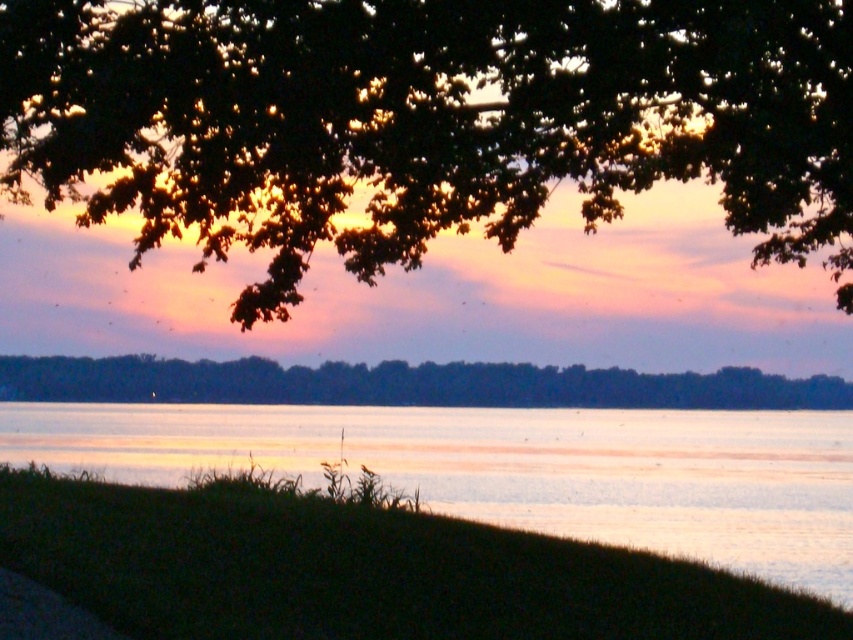
Is point (415, 483) closer to viewer compared to point (770, 396)?

Yes, it is.

Is silvery reflective water at lower center smaller than dark green leafy trees at center?

No.

What do you see at coordinates (515, 468) in the screenshot? I see `silvery reflective water at lower center` at bounding box center [515, 468].

You are a GUI agent. You are given a task and a screenshot of the screen. Output one action in this format:
    pyautogui.click(x=<x>, y=<y>)
    Task: Click on the silvery reflective water at lower center
    This screenshot has height=640, width=853.
    Given the screenshot: What is the action you would take?
    pyautogui.click(x=515, y=468)

Is point (115, 22) positioned in front of point (28, 451)?

Yes, it is in front of point (28, 451).

Does green leafy tree at upper center have a greater height compared to silvery reflective water at lower center?

Correct, green leafy tree at upper center is much taller as silvery reflective water at lower center.

Does point (386, 188) come farther from viewer compared to point (659, 422)?

No, (386, 188) is in front of (659, 422).

At what (x,y) coordinates should I click in order to perform the action: click on green leafy tree at upper center. Please return your answer as a coordinate pair (x, y). This screenshot has width=853, height=640. Looking at the image, I should click on (425, 120).

Is the position of green leafy tree at upper center less distant than that of dark green leafy trees at center?

Yes, green leafy tree at upper center is in front of dark green leafy trees at center.

Is green leafy tree at upper center below dark green leafy trees at center?

Incorrect, green leafy tree at upper center is not positioned below dark green leafy trees at center.

Between point (361, 244) and point (25, 387), which one is positioned in front?

Point (361, 244)

This screenshot has width=853, height=640. In order to click on green leafy tree at upper center in this screenshot , I will do `click(425, 120)`.